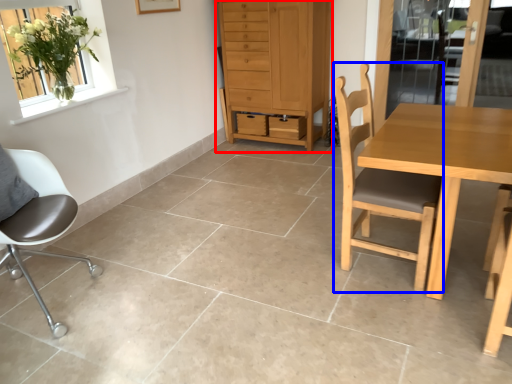
Question: Which object appears closest to the camera in this image, cabinetry (highlighted by a red box) or chair (highlighted by a blue box)?

Choices:
 (A) cabinetry
 (B) chair

Answer: (B)